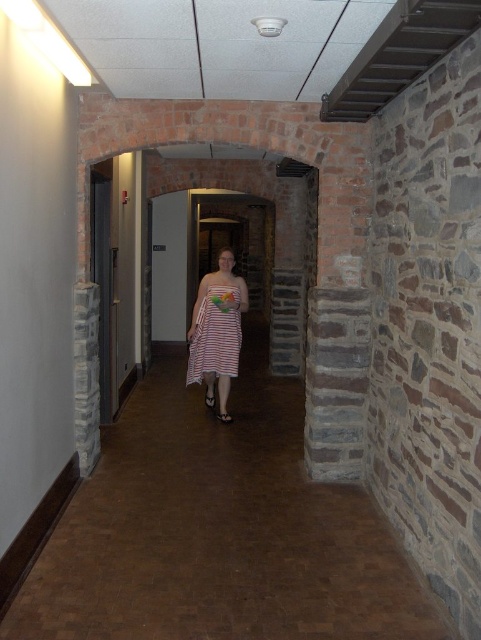
You are a security camera monitoring the corridor. You need to determine if the striped fabric dress at center is wider than the translucent plastic bouquet at center. Based on the scene description, can you confirm this?

The striped fabric dress at center might be wider than the translucent plastic bouquet at center according to the description.

You are a delivery robot moving along the corridor and need to avoid obstacles. You see the brown polished wood floor at center and the translucent plastic bouquet at center. Which object should you avoid stepping on?

You should avoid stepping on the translucent plastic bouquet at center because it is above the brown polished wood floor at center, meaning it is an obstacle in your path.

You are navigating a corridor with stone walls and want to step onto the brown polished wood floor at center. Based on its position, where exactly should you aim to place your foot?

The brown polished wood floor at center is located at point 0.830 on the x axis and 0.455 on the y axis, so you should aim to place your foot there.